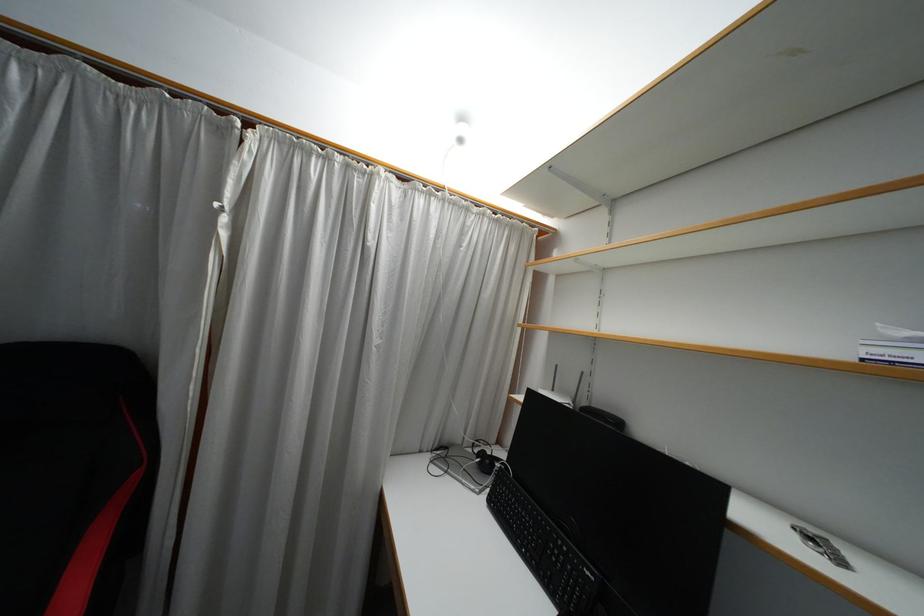
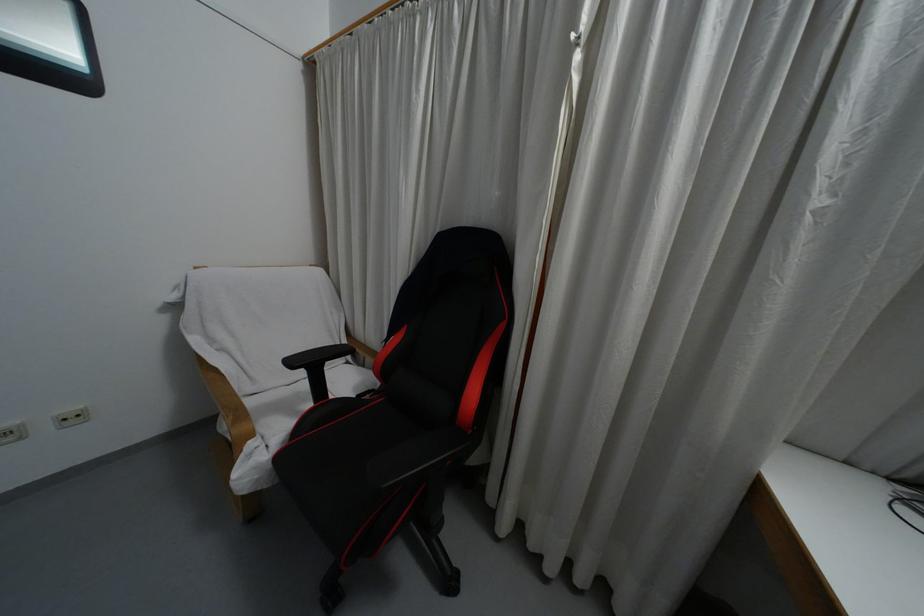
Question: The first image is from the beginning of the video and the second image is from the end. How did the camera likely rotate when shooting the video?

Choices:
 (A) Left
 (B) Right
 (C) Up
 (D) Down

Answer: (A)